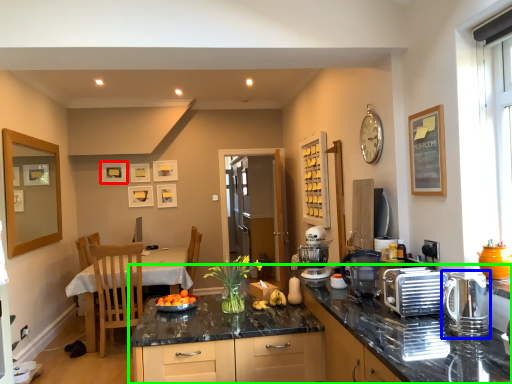
Question: Based on their relative distances, which object is nearer to picture frame (highlighted by a red box)? Choose from kitchen appliance (highlighted by a blue box) and countertop (highlighted by a green box).

Choices:
 (A) kitchen appliance
 (B) countertop

Answer: (B)